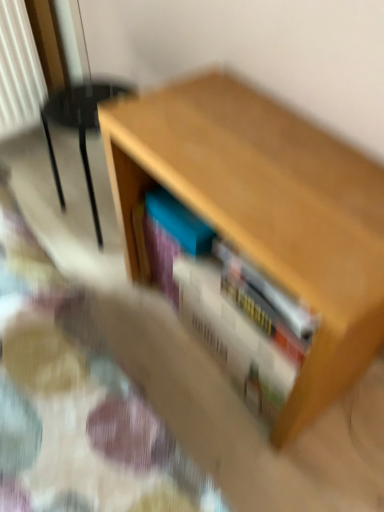
In order to click on free space above white matte book at center (from a real-world perspective) in this screenshot , I will do `click(230, 297)`.